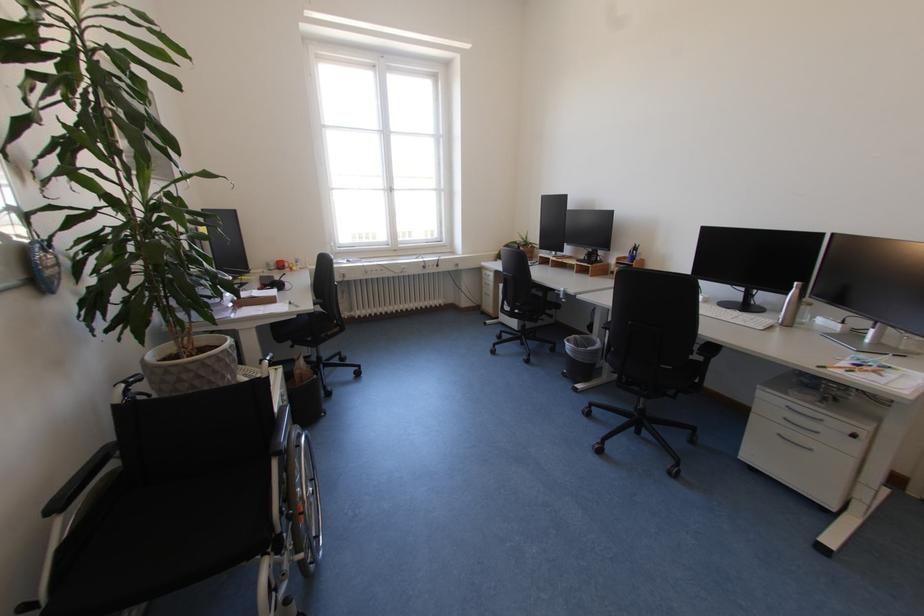
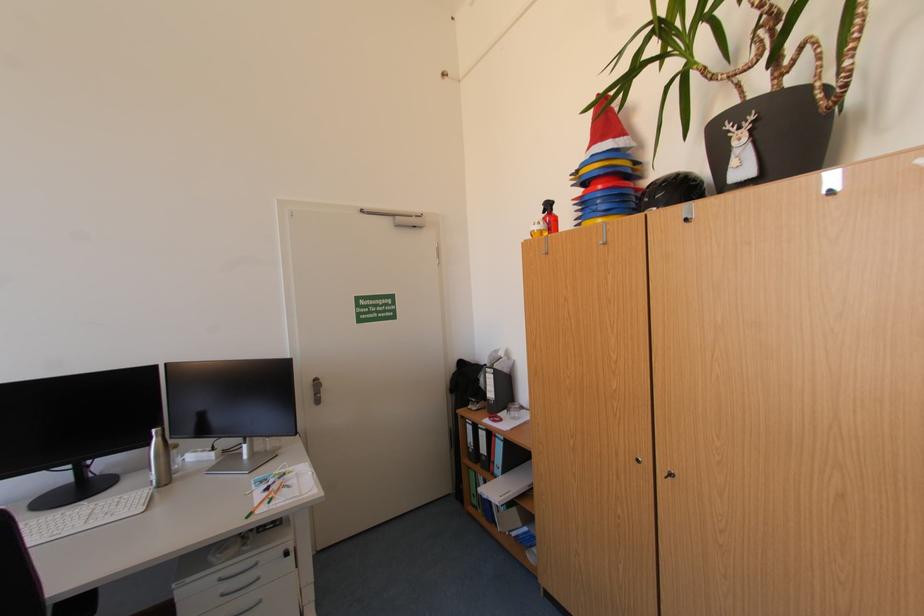
Question: How did the camera likely rotate?

Choices:
 (A) Left
 (B) Right
 (C) Up
 (D) Down

Answer: (B)